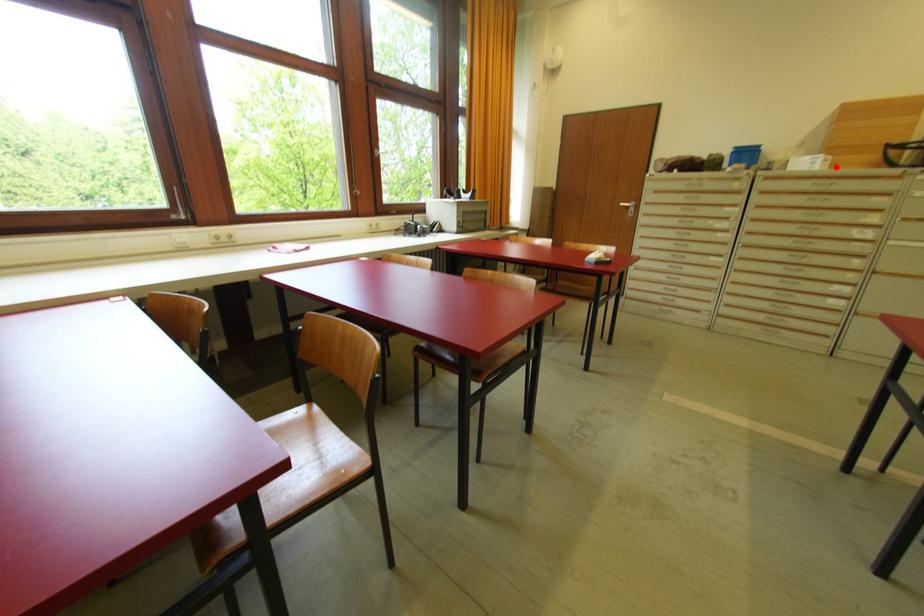
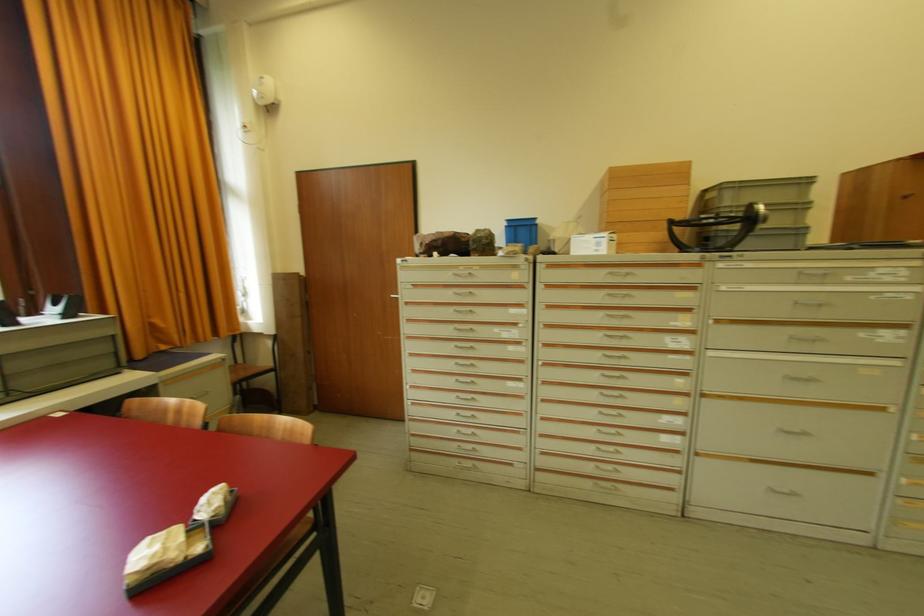
Question: I am providing you with two images of the same scene from different viewpoints. Image1 has a red point marked. In image2, the corresponding 3D location appears at what relative position? Reply with the corresponding letter.

Choices:
 (A) Closer
 (B) Farther

Answer: (A)